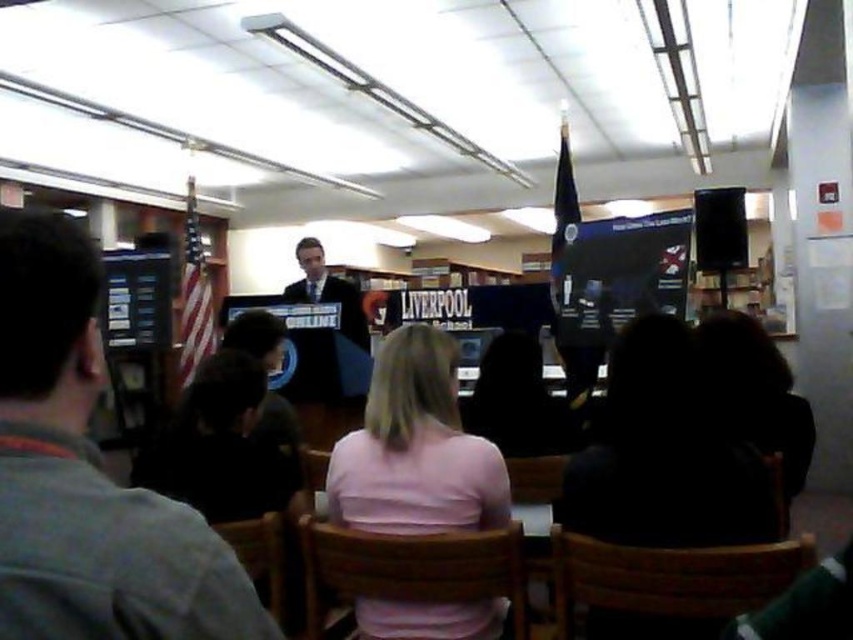
Question: Is pink fabric shirt at center below dark suit at center?

Choices:
 (A) yes
 (B) no

Answer: (A)

Question: Considering the relative positions of pink fabric shirt at center and wooden chair at lower right in the image provided, where is pink fabric shirt at center located with respect to wooden chair at lower right?

Choices:
 (A) below
 (B) above

Answer: (B)

Question: Which of the following is the closest to the observer?

Choices:
 (A) (320, 563)
 (B) (378, 524)
 (C) (724, 609)
 (D) (248, 534)

Answer: (C)

Question: Which point appears farthest from the camera in this image?

Choices:
 (A) (306, 284)
 (B) (711, 266)
 (C) (265, 561)
 (D) (334, 564)

Answer: (B)

Question: Does wooden chair at center come in front of wooden chair at lower center?

Choices:
 (A) yes
 (B) no

Answer: (A)

Question: Among these objects, which one is nearest to the camera?

Choices:
 (A) dark gray shirt at left
 (B) wooden chair at lower center
 (C) pink fabric shirt at center

Answer: (A)